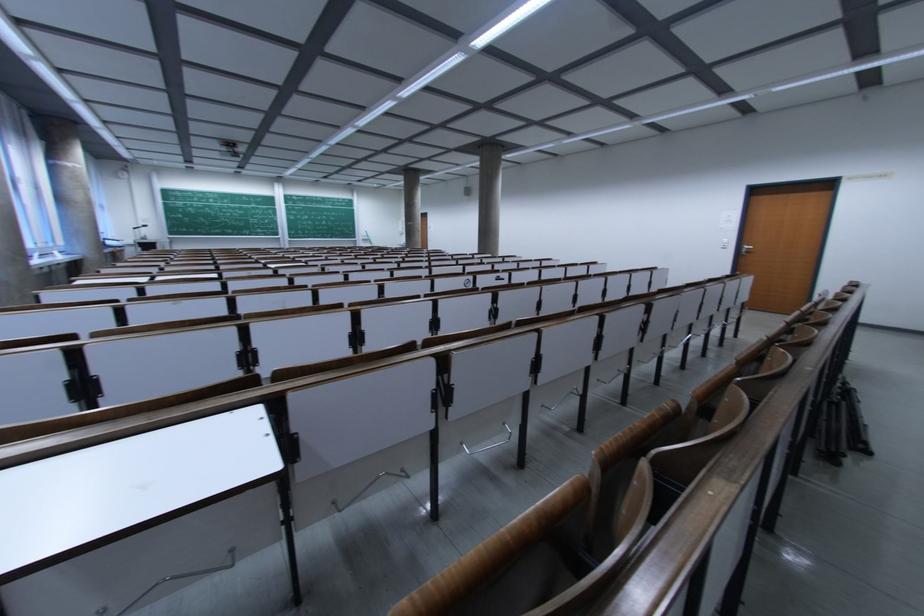
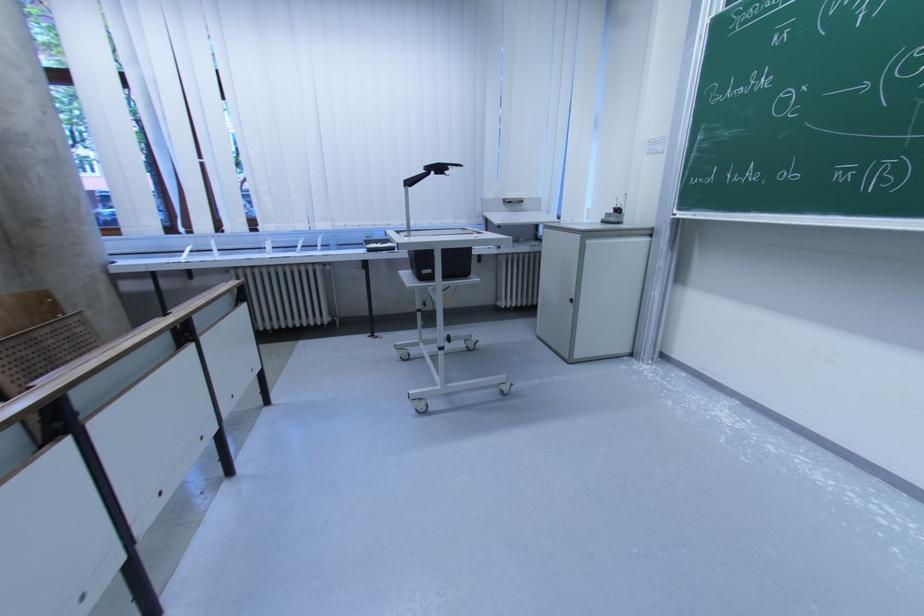
Locate, in the second image, the point that corresponds to point 139,231 in the first image.

(415, 185)